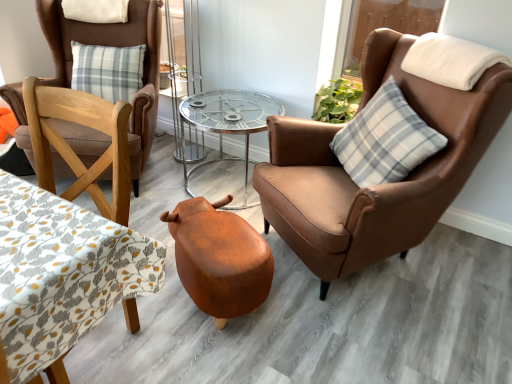
Question: Is brown leather chair at right, arranged as the 2th chair when viewed from the left, surrounded by leather-like stool at center?

Choices:
 (A) yes
 (B) no

Answer: (B)

Question: Is leather-like stool at center shorter than brown leather chair at right, positioned as the 1th chair in right-to-left order?

Choices:
 (A) no
 (B) yes

Answer: (B)

Question: Does leather-like stool at center appear on the right side of brown leather chair at right, arranged as the 2th chair when viewed from the left?

Choices:
 (A) no
 (B) yes

Answer: (A)

Question: Is leather-like stool at center completely or partially outside of brown leather chair at right, arranged as the 2th chair when viewed from the left?

Choices:
 (A) yes
 (B) no

Answer: (A)

Question: Is leather-like stool at center far away from brown leather chair at right, arranged as the 2th chair when viewed from the left?

Choices:
 (A) no
 (B) yes

Answer: (A)

Question: Is white fleece pillow at upper right, the second pillow viewed from the top, situated inside clear glass table at center or outside?

Choices:
 (A) outside
 (B) inside

Answer: (A)

Question: Is point (437, 74) positioned closer to the camera than point (252, 120)?

Choices:
 (A) farther
 (B) closer

Answer: (B)

Question: Is white fleece pillow at upper right, the third pillow when ordered from left to right, bigger or smaller than clear glass table at center?

Choices:
 (A) small
 (B) big

Answer: (A)

Question: Is white fleece pillow at upper right, the second pillow viewed from the top, in front of or behind clear glass table at center in the image?

Choices:
 (A) front
 (B) behind

Answer: (A)

Question: Looking at their shapes, would you say leather-like stool at center is wider or thinner than patterned fabric table at left?

Choices:
 (A) wide
 (B) thin

Answer: (A)

Question: Which is correct: leather-like stool at center is inside patterned fabric table at left, or outside of it?

Choices:
 (A) outside
 (B) inside

Answer: (A)

Question: Does point (208, 299) appear closer or farther from the camera than point (20, 339)?

Choices:
 (A) closer
 (B) farther

Answer: (B)

Question: Is leather-like stool at center taller or shorter than patterned fabric table at left?

Choices:
 (A) short
 (B) tall

Answer: (A)

Question: Looking at their shapes, would you say brown leather chair at left, acting as the first chair starting from the left, is wider or thinner than leather-like stool at center?

Choices:
 (A) wide
 (B) thin

Answer: (A)

Question: Is brown leather chair at left, acting as the first chair starting from the left, taller or shorter than leather-like stool at center?

Choices:
 (A) tall
 (B) short

Answer: (A)